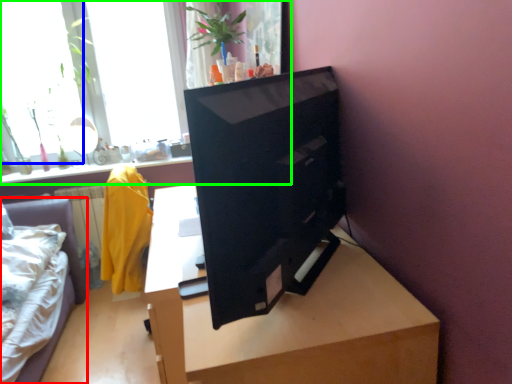
Question: Estimate the real-world distances between objects in this image. Which object is closer to furniture (highlighted by a red box), window (highlighted by a blue box) or window (highlighted by a green box)?

Choices:
 (A) window
 (B) window

Answer: (A)